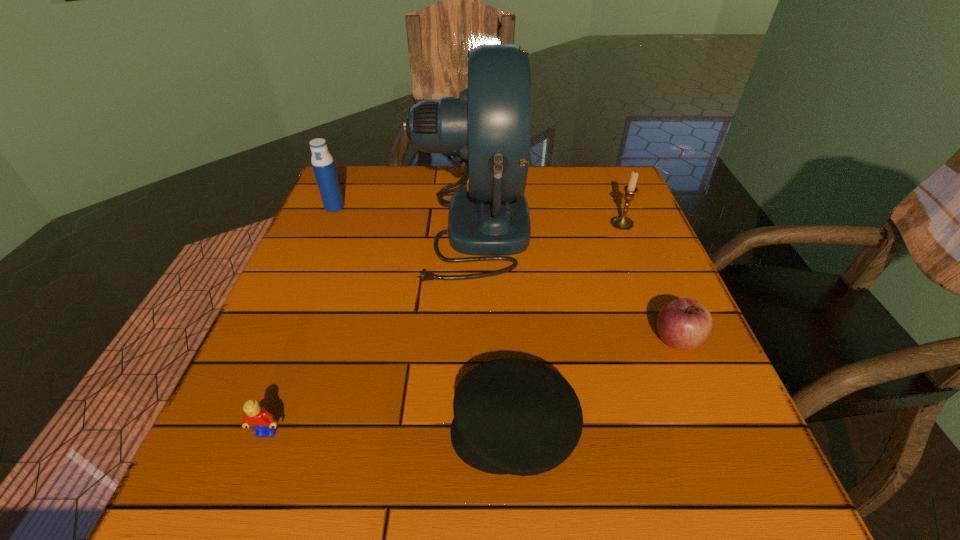
Identify the location of vacant space situated on the left of the apple. (490, 341).

Locate an element on the screen. This screenshot has width=960, height=540. vacant region located 0.340m on the front-facing side of the beret is located at coordinates (231, 431).

The width and height of the screenshot is (960, 540). Find the location of `vacant space located on the front-facing side of the beret`. vacant space located on the front-facing side of the beret is located at coordinates (276, 431).

I want to click on blank space located on the front-facing side of the beret, so click(x=302, y=431).

Where is `vacant position located on the front-facing side of the Lego`? This screenshot has width=960, height=540. vacant position located on the front-facing side of the Lego is located at coordinates click(x=245, y=492).

The width and height of the screenshot is (960, 540). What are the coordinates of `fan at the far edge` in the screenshot? It's located at (488, 127).

Identify the location of water bottle positioned at the far edge. The height and width of the screenshot is (540, 960). (322, 161).

Where is `object that is at the near edge`? This screenshot has height=540, width=960. object that is at the near edge is located at coordinates (512, 416).

I want to click on water bottle located at the left edge, so click(322, 161).

At what (x,y) coordinates should I click in order to perform the action: click on Lego that is at the left edge. Please return your answer as a coordinate pair (x, y). The width and height of the screenshot is (960, 540). Looking at the image, I should click on (258, 418).